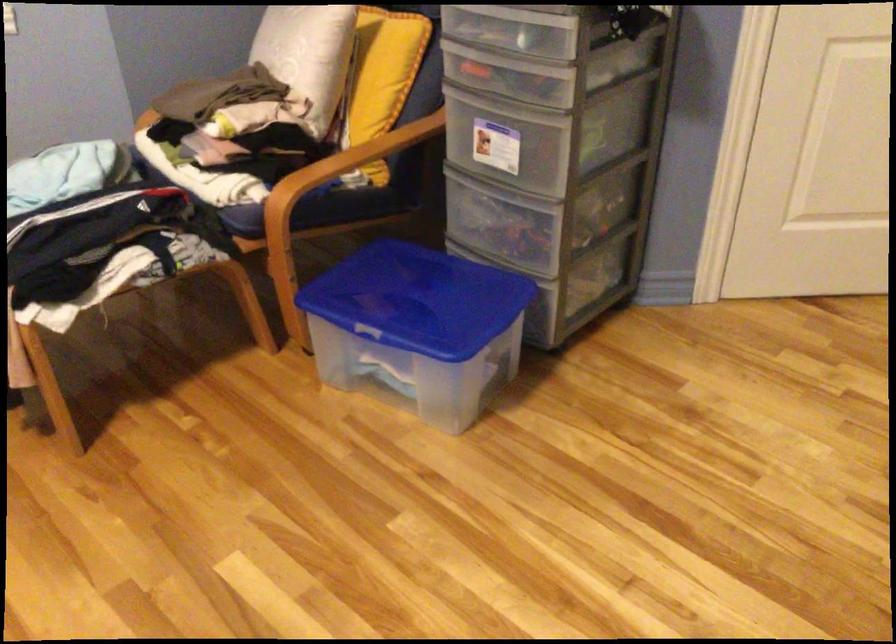
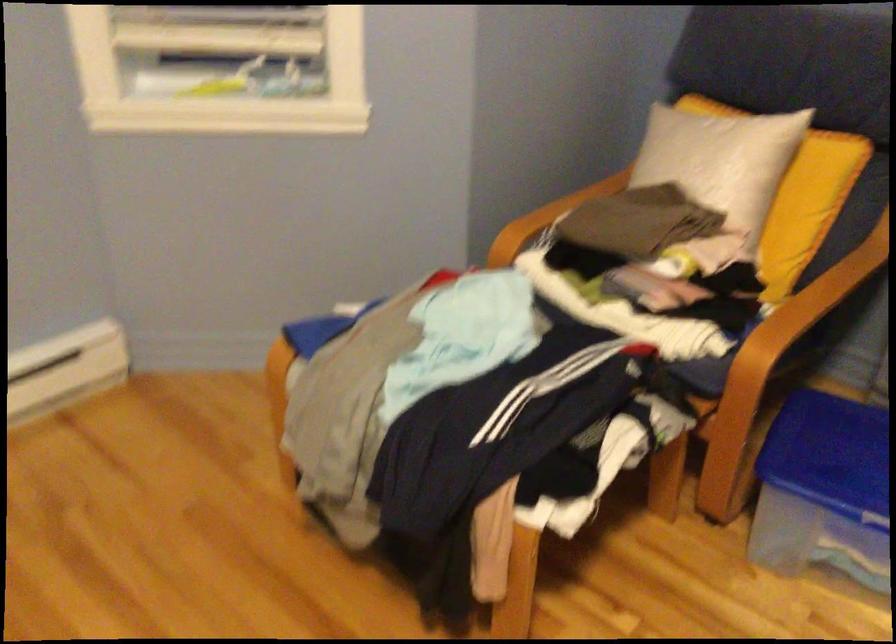
Question: In a continuous first-person perspective shot, in which direction is the camera moving?

Choices:
 (A) Left
 (B) Right
 (C) Forward
 (D) Backward

Answer: (A)